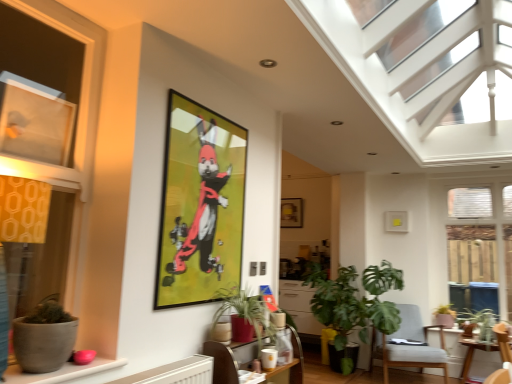
Question: Which direction should I rotate to face matte ceramic pot at lower center, which appears as the second flowerpot when viewed from the top, — up or down?

Choices:
 (A) down
 (B) up

Answer: (A)

Question: Is matte brown flowerpot at lower right, the 1th flowerpot from the bottom, surrounded by metallic gold picture frame at upper center, placed as the 2th picture frame when sorted from back to front?

Choices:
 (A) yes
 (B) no

Answer: (B)

Question: From the image's perspective, is metallic gold picture frame at upper center, the 2th picture frame in the right-to-left sequence, below matte brown flowerpot at lower right, marked as the first flowerpot in a back-to-front arrangement?

Choices:
 (A) no
 (B) yes

Answer: (A)

Question: Is metallic gold picture frame at upper center, placed as the 1th picture frame when sorted from left to right, taller than matte brown flowerpot at lower right, the 1th flowerpot from the bottom?

Choices:
 (A) no
 (B) yes

Answer: (B)

Question: Considering the relative positions of metallic gold picture frame at upper center, placed as the 2th picture frame when sorted from back to front, and matte brown flowerpot at lower right, which is the 3th flowerpot from front to back, in the image provided, is metallic gold picture frame at upper center, placed as the 2th picture frame when sorted from back to front, to the left of matte brown flowerpot at lower right, which is the 3th flowerpot from front to back, from the viewer's perspective?

Choices:
 (A) no
 (B) yes

Answer: (B)

Question: From the image's perspective, is metallic gold picture frame at upper center, which appears as the 1th picture frame when viewed from the front, located above matte brown flowerpot at lower right, marked as the 3th flowerpot in a top-to-bottom arrangement?

Choices:
 (A) no
 (B) yes

Answer: (B)

Question: Can you confirm if metallic gold picture frame at upper center, which appears as the 1th picture frame when viewed from the front, is thinner than matte brown flowerpot at lower right, the 1th flowerpot from the bottom?

Choices:
 (A) no
 (B) yes

Answer: (B)

Question: Is clear glass door at right, the 1th window viewed from the right, at the left side of green leafy plant at center, marked as the 2th houseplant in a front-to-back arrangement?

Choices:
 (A) no
 (B) yes

Answer: (A)

Question: From the image's perspective, is clear glass door at right, which ranks as the 3th window in left-to-right order, over green leafy plant at center, the second houseplant from the left?

Choices:
 (A) no
 (B) yes

Answer: (B)

Question: From a real-world perspective, is clear glass door at right, the 3th window when ordered from front to back, on top of green leafy plant at center, the second houseplant positioned from the right?

Choices:
 (A) yes
 (B) no

Answer: (A)

Question: Would you consider clear glass door at right, which ranks as the 3th window in left-to-right order, to be distant from green leafy plant at center, the second houseplant from the left?

Choices:
 (A) yes
 (B) no

Answer: (A)

Question: Is the position of clear glass door at right, the 3th window when ordered from front to back, less distant than that of green leafy plant at center, the second houseplant positioned from the right?

Choices:
 (A) no
 (B) yes

Answer: (A)

Question: Does clear glass door at right, which ranks as the 3th window in left-to-right order, contain green leafy plant at center, the second houseplant in the back-to-front sequence?

Choices:
 (A) yes
 (B) no

Answer: (B)

Question: Considering the relative sizes of matte gray pot at lower left, the 1th flowerpot positioned from the top, and matte glass window at left, the 2th window when ordered from back to front, in the image provided, is matte gray pot at lower left, the 1th flowerpot positioned from the top, wider than matte glass window at left, the 2th window when ordered from back to front,?

Choices:
 (A) no
 (B) yes

Answer: (B)